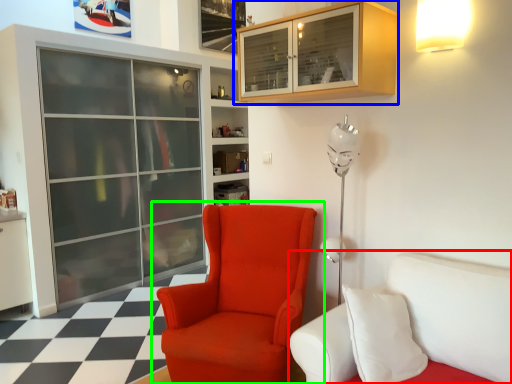
Question: Which object is positioned closest to studio couch (highlighted by a red box)? Select from cabinetry (highlighted by a blue box) and chair (highlighted by a green box).

Choices:
 (A) cabinetry
 (B) chair

Answer: (B)